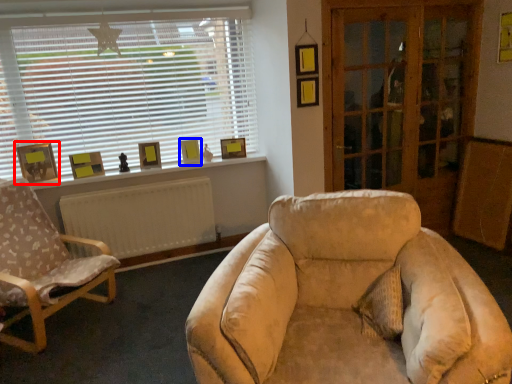
Question: Which of the following is the closest to the observer, picture frame (highlighted by a red box) or picture frame (highlighted by a blue box)?

Choices:
 (A) picture frame
 (B) picture frame

Answer: (A)